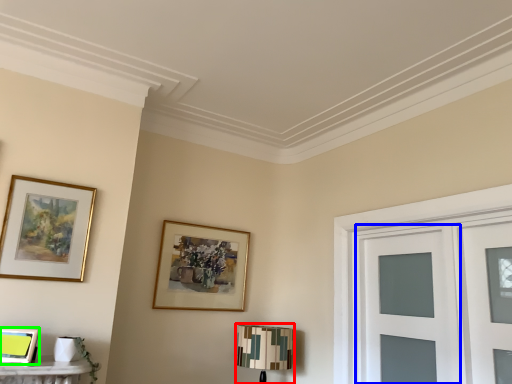
Question: Which object is positioned farthest from table lamp (highlighted by a red box)? Select from glass door (highlighted by a blue box) and picture frame (highlighted by a green box).

Choices:
 (A) glass door
 (B) picture frame

Answer: (B)